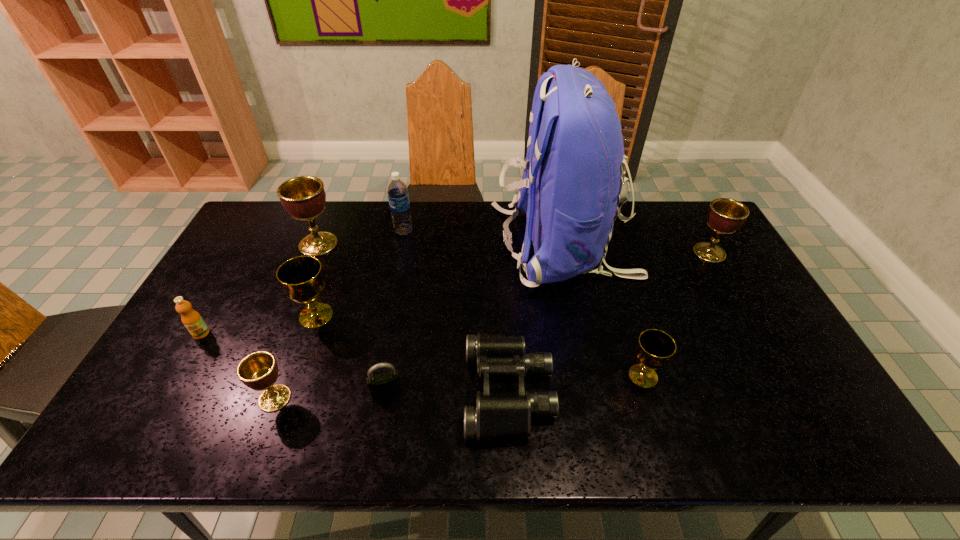
At what (x,y) coordinates should I click in order to perform the action: click on free space located on the left of the bigger gold chalice. Please return your answer as a coordinate pair (x, y). This screenshot has height=540, width=960. Looking at the image, I should click on (237, 315).

Locate an element on the screen. free region located on the front label of the leftmost object is located at coordinates (151, 421).

The image size is (960, 540). What are the coordinates of `vacant space located on the left of the right gold chalice` in the screenshot? It's located at (595, 376).

Locate an element on the screen. vacant position located on the back of the nearest golden chalice is located at coordinates (312, 299).

The width and height of the screenshot is (960, 540). Find the location of `free space located on the left of the black padlock`. free space located on the left of the black padlock is located at coordinates (323, 392).

This screenshot has width=960, height=540. In order to click on blank area located on the front-facing side of the black binoculars in this screenshot , I will do `click(417, 392)`.

Image resolution: width=960 pixels, height=540 pixels. What are the coordinates of `free region located 0.280m on the front-facing side of the black binoculars` in the screenshot? It's located at (352, 392).

The width and height of the screenshot is (960, 540). Identify the location of free space located 0.250m on the front-facing side of the black binoculars. (364, 392).

At what (x,y) coordinates should I click in order to perform the action: click on backpack positioned at the far edge. Please return your answer as a coordinate pair (x, y). Image resolution: width=960 pixels, height=540 pixels. Looking at the image, I should click on (573, 181).

I want to click on water bottle at the far edge, so click(398, 196).